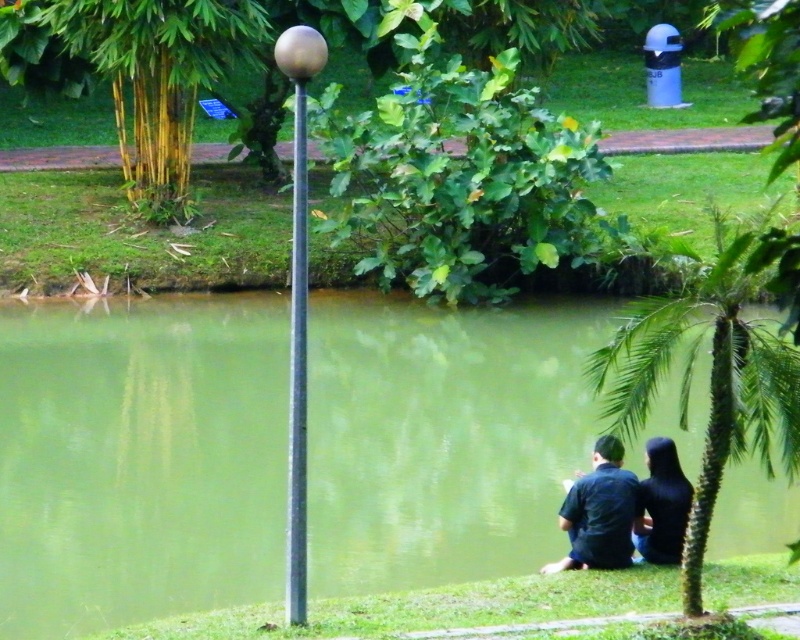
Question: Which point is closer to the camera?

Choices:
 (A) (648, 541)
 (B) (300, 84)
 (C) (296, 515)
 (D) (590, 480)

Answer: (B)

Question: Can you confirm if dark blue shirt at lower center is smaller than dark blue fabric dress at lower right?

Choices:
 (A) yes
 (B) no

Answer: (B)

Question: From the image, what is the correct spatial relationship of dark blue shirt at lower center in relation to dark blue fabric dress at lower right?

Choices:
 (A) right
 (B) left

Answer: (B)

Question: Among these objects, which one is nearest to the camera?

Choices:
 (A) dark blue shirt at lower center
 (B) dark blue fabric dress at lower right

Answer: (A)

Question: Which of the following is the farthest from the observer?

Choices:
 (A) (594, 477)
 (B) (310, 68)
 (C) (292, 529)
 (D) (314, 472)

Answer: (D)

Question: Is silver metallic pole at center wider than dark blue shirt at lower center?

Choices:
 (A) no
 (B) yes

Answer: (A)